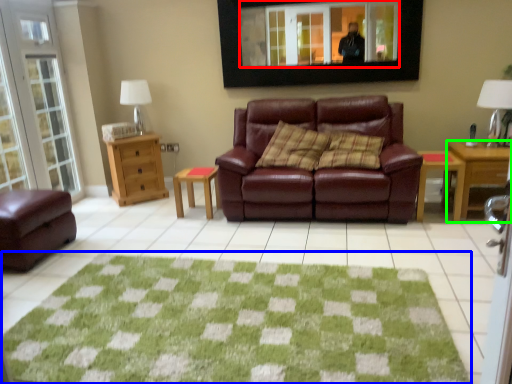
Question: Estimate the real-world distances between objects in this image. Which object is farther from mirror (highlighted by a red box), doormat (highlighted by a blue box) or desk (highlighted by a green box)?

Choices:
 (A) doormat
 (B) desk

Answer: (A)